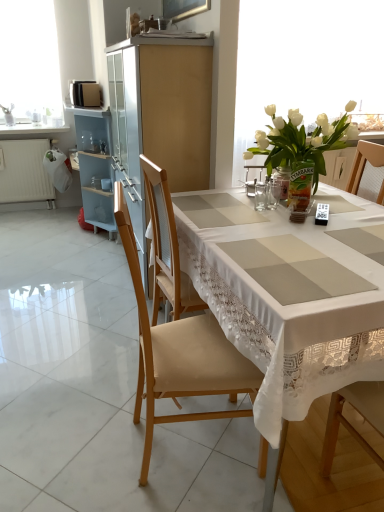
Image resolution: width=384 pixels, height=512 pixels. What do you see at coordinates (167, 248) in the screenshot? I see `wooden chair at center, placed as the 2th chair when sorted from front to back` at bounding box center [167, 248].

In order to face white glossy countertop at upper left, should I rotate leftwards or rightwards?

Rotate your view left by about 20.344°.

At what (x,y) coordinates should I click in order to perform the action: click on white glossy countertop at upper left. Please return your answer as a coordinate pair (x, y). Looking at the image, I should click on (31, 131).

Where is `matte wood cabinet at center`? matte wood cabinet at center is located at coordinates (160, 116).

What is the approximate width of wooden chair at center, marked as the first chair in a front-to-back arrangement?

wooden chair at center, marked as the first chair in a front-to-back arrangement, is 19.41 inches wide.

This screenshot has width=384, height=512. What do you see at coordinates (300, 185) in the screenshot?
I see `translucent glass vase at upper right` at bounding box center [300, 185].

At what (x,y) coordinates should I click in order to perform the action: click on white matte radiator at left. Please return your answer as a coordinate pair (x, y). The height and width of the screenshot is (512, 384). Looking at the image, I should click on (25, 172).

Would you say white matte radiator at left is outside white lace tablecloth at center?

Yes, white matte radiator at left is located beyond the bounds of white lace tablecloth at center.

From a real-world perspective, is white matte radiator at left beneath white lace tablecloth at center?

Yes.

In terms of height, does white matte radiator at left look taller or shorter compared to white lace tablecloth at center?

Clearly, white matte radiator at left is shorter compared to white lace tablecloth at center.

What's the angular difference between white matte radiator at left and white lace tablecloth at center's facing directions?

The facing directions of white matte radiator at left and white lace tablecloth at center are 1.98 degrees apart.

From a real-world perspective, is white lace tablecloth at center beneath white matte radiator at left?

No.

Looking at this image, is white lace tablecloth at center wider than white matte radiator at left?

Yes.

How distant is white lace tablecloth at center from white matte radiator at left?

They are 10.29 feet apart.

Between point (358, 376) and point (33, 191), which one is positioned behind?

The point (33, 191) is farther from the camera.

From a real-world perspective, relative to translucent glass vase at upper right, is wooden chair at center, placed as the 2th chair when sorted from front to back, vertically above or below?

wooden chair at center, placed as the 2th chair when sorted from front to back, is situated lower than translucent glass vase at upper right in the real world.

Do you think wooden chair at center, placed as the 2th chair when sorted from front to back, is within translucent glass vase at upper right, or outside of it?

wooden chair at center, placed as the 2th chair when sorted from front to back, is spatially situated outside translucent glass vase at upper right.

This screenshot has height=512, width=384. What are the coordinates of `vase that is behind the wooden chair at center, marked as the first chair in a back-to-front arrangement` in the screenshot? It's located at (300, 185).

Based on their positions, is wooden chair at center, marked as the first chair in a back-to-front arrangement, located to the left or right of translucent glass vase at upper right?

Clearly, wooden chair at center, marked as the first chair in a back-to-front arrangement, is on the left of translucent glass vase at upper right in the image.

Between white glass vase at upper right and white matte radiator at left, which one has larger width?

white glass vase at upper right is wider.

Is white glass vase at upper right shorter than white matte radiator at left?

In fact, white glass vase at upper right may be taller than white matte radiator at left.

Consider the image. Considering their positions, is white glass vase at upper right located in front of or behind white matte radiator at left?

Visually, white glass vase at upper right is located in front of white matte radiator at left.

From a real-world perspective, who is located lower, white glass vase at upper right or white matte radiator at left?

white matte radiator at left.

Based on their sizes in the image, would you say clear glass jar at center is bigger or smaller than matte wood cabinet at center?

clear glass jar at center is smaller than matte wood cabinet at center.

Is clear glass jar at center placed right next to matte wood cabinet at center?

No, clear glass jar at center is not beside matte wood cabinet at center.

Considering the positions of objects white matte radiator at left and clear glass jar at center in the image provided, who is more to the right, white matte radiator at left or clear glass jar at center?

clear glass jar at center is more to the right.

Would you say clear glass jar at center is part of white matte radiator at left's contents?

That's incorrect, clear glass jar at center is not inside white matte radiator at left.

Considering their positions, is white matte radiator at left located in front of or behind clear glass jar at center?

Clearly, white matte radiator at left is behind clear glass jar at center.

Considering the points (33, 158) and (265, 193), which point is behind, point (33, 158) or point (265, 193)?

Point (33, 158)

From the image's perspective, is white matte placemat at center above or below matte wood cabinet at center?

From the image's perspective, white matte placemat at center appears below matte wood cabinet at center.

Considering the positions of objects white matte placemat at center and matte wood cabinet at center in the image provided, who is in front, white matte placemat at center or matte wood cabinet at center?

white matte placemat at center is in front.

Who is shorter, white matte placemat at center or matte wood cabinet at center?

white matte placemat at center.

The width and height of the screenshot is (384, 512). Find the location of `kitchen & dining room table lying on the right of white matte radiator at left`. kitchen & dining room table lying on the right of white matte radiator at left is located at coordinates (282, 306).

Identify the location of kitchen & dining room table that is in front of the white matte radiator at left. (282, 306).

From the image, which object appears to be farther from matte wood cabinet at center, white glass vase at upper right or wooden chair at center, marked as the first chair in a back-to-front arrangement?

white glass vase at upper right is further to matte wood cabinet at center.

Looking at the image, which one is located further to white glossy countertop at upper left, clear glass jar at center or matte wood cabinet at center?

The object further to white glossy countertop at upper left is clear glass jar at center.

Estimate the real-world distances between objects in this image. Which object is closer to white matte radiator at left, white glossy countertop at upper left or translucent glass vase at upper right?

Among the two, white glossy countertop at upper left is located nearer to white matte radiator at left.

From the image, which object appears to be nearer to wooden chair at center, placed as the 2th chair when sorted from front to back, white lace tablecloth at center or white glass vase at upper right?

The object closer to wooden chair at center, placed as the 2th chair when sorted from front to back, is white lace tablecloth at center.

Considering their positions, is translucent glass vase at upper right positioned closer to matte wood cabinet at center than white matte placemat at center?

Among the two, translucent glass vase at upper right is located nearer to matte wood cabinet at center.

Considering their positions, is white matte radiator at left positioned closer to clear glass jar at center than white matte placemat at center?

Among the two, white matte placemat at center is located nearer to clear glass jar at center.

Which object lies nearer to the anchor point wooden chair at center, which ranks as the 2th chair in back-to-front order, wooden chair at center, placed as the 2th chair when sorted from front to back, or white glossy countertop at upper left?

Among the two, wooden chair at center, placed as the 2th chair when sorted from front to back, is located nearer to wooden chair at center, which ranks as the 2th chair in back-to-front order.

Which object lies nearer to the anchor point wooden chair at center, which ranks as the 2th chair in back-to-front order, wooden chair at center, placed as the 2th chair when sorted from front to back, or white lace tablecloth at center?

The object closer to wooden chair at center, which ranks as the 2th chair in back-to-front order, is white lace tablecloth at center.

This screenshot has height=512, width=384. In order to click on kitchen & dining room table positioned between white matte placemat at center and translucent glass vase at upper right from near to far in this screenshot , I will do `click(282, 306)`.

Identify the location of tableware positioned between wooden chair at center, which ranks as the 2th chair in back-to-front order, and white glass vase at upper right from near to far. Image resolution: width=384 pixels, height=512 pixels. (260, 196).

In order to click on vase between white lace tablecloth at center and white glossy countertop at upper left along the z-axis in this screenshot , I will do (x=300, y=185).

The image size is (384, 512). Identify the location of tableware between white lace tablecloth at center and translucent glass vase at upper right along the z-axis. click(260, 196).